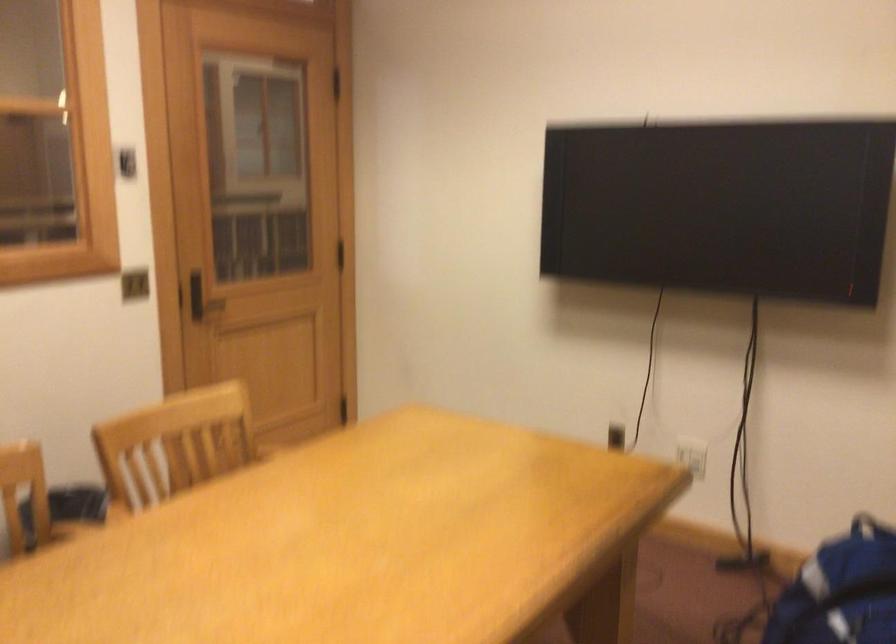
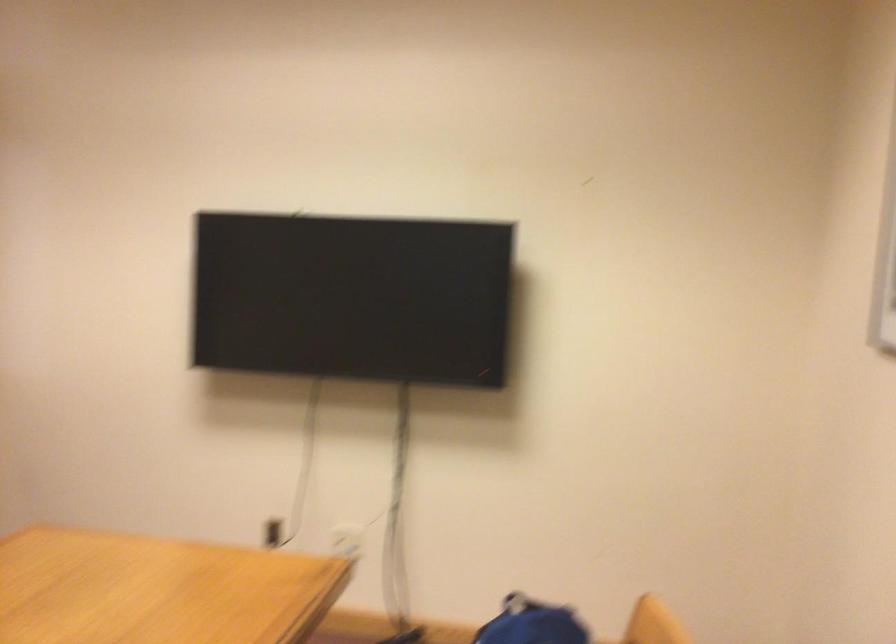
Question: The camera is either moving clockwise (left) or counter-clockwise (right) around the object. The first image is from the beginning of the video and the second image is from the end. Is the camera moving left or right when shooting the video?

Choices:
 (A) Left
 (B) Right

Answer: (A)